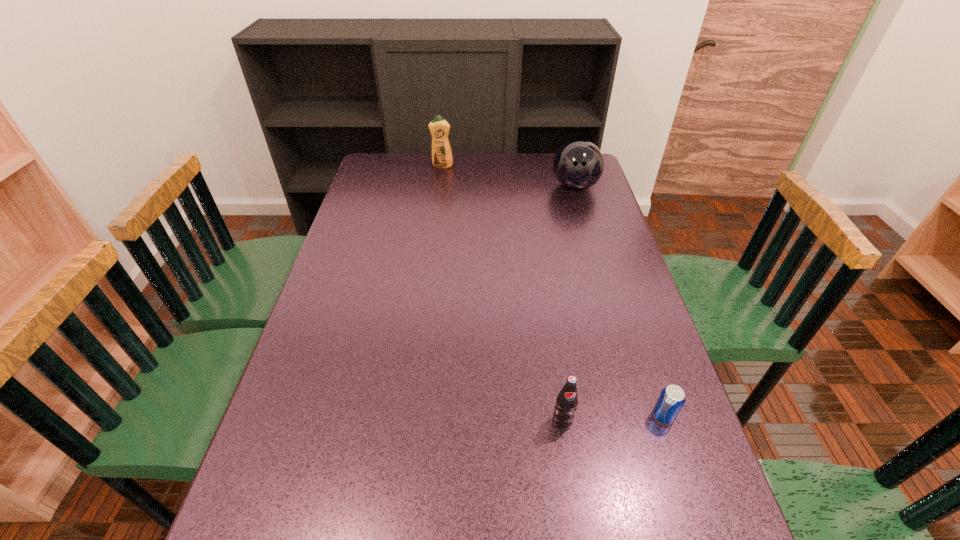
Where is `object that stands as the third closest to the second farthest object`? The width and height of the screenshot is (960, 540). object that stands as the third closest to the second farthest object is located at coordinates (566, 404).

Locate an element on the screen. free space that satisfies the following two spatial constraints: 1. on the side of the beer can with the finger holes; 2. on the left side of the second farthest object is located at coordinates click(x=641, y=416).

The height and width of the screenshot is (540, 960). Find the location of `free space in the image that satisfies the following two spatial constraints: 1. on the label of the shortest object; 2. on the left side of the detergent`. free space in the image that satisfies the following two spatial constraints: 1. on the label of the shortest object; 2. on the left side of the detergent is located at coordinates (411, 416).

Find the location of `vacant region that satisfies the following two spatial constraints: 1. on the label of the detergent; 2. on the left side of the beer can`. vacant region that satisfies the following two spatial constraints: 1. on the label of the detergent; 2. on the left side of the beer can is located at coordinates (411, 416).